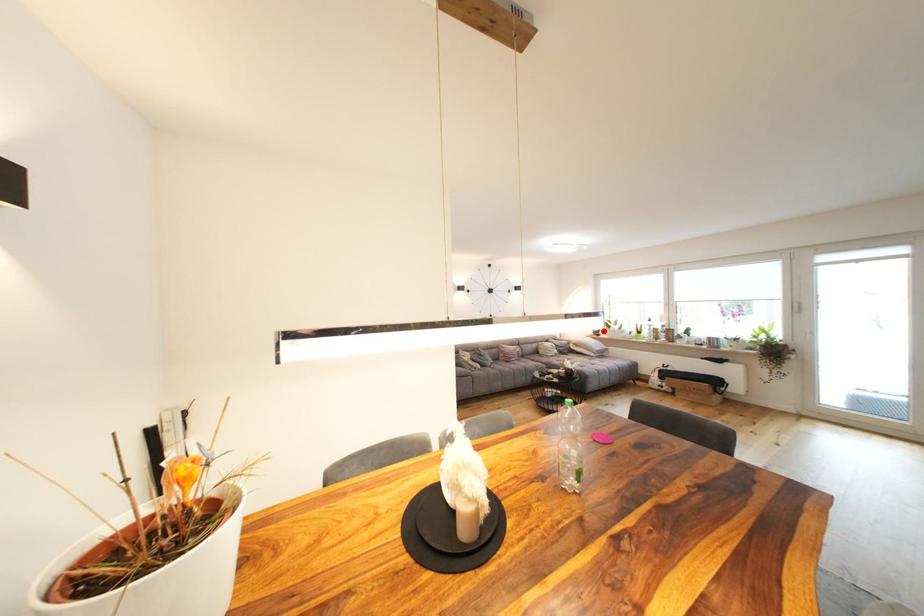
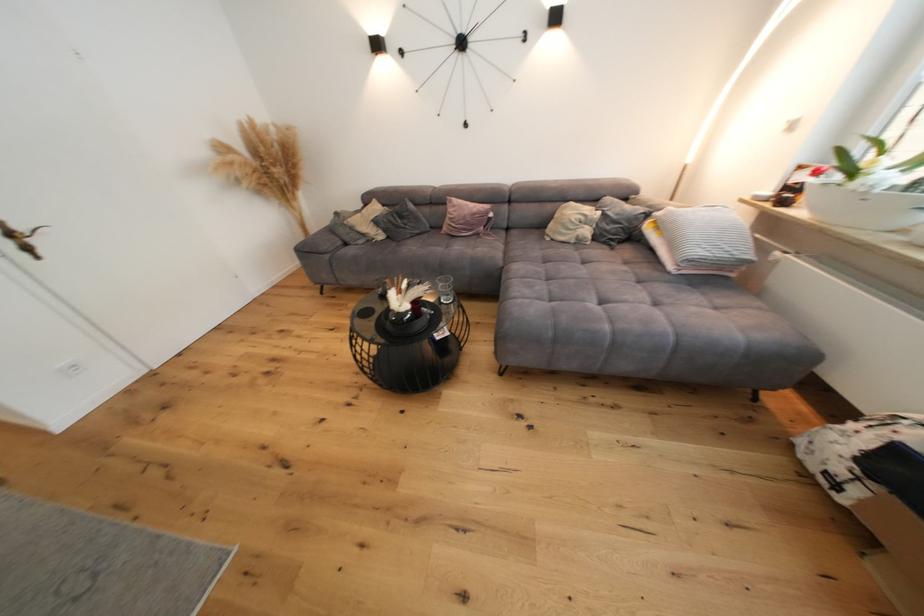
Question: I am providing you with two images of the same scene from different viewpoints. Given a red point in image1, look at the same physical point in image2. Is it:

Choices:
 (A) Closer to the viewpoint
 (B) Farther from the viewpoint

Answer: (A)